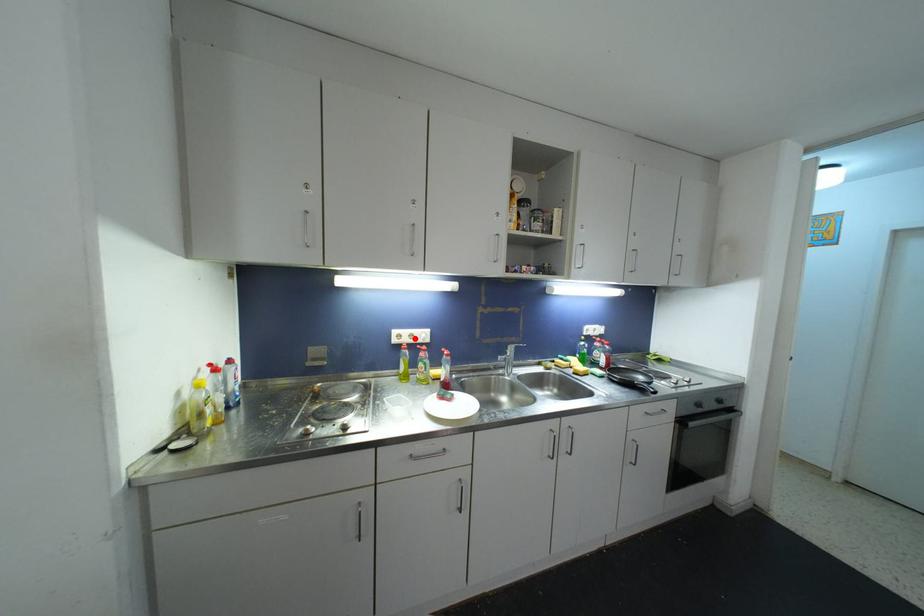
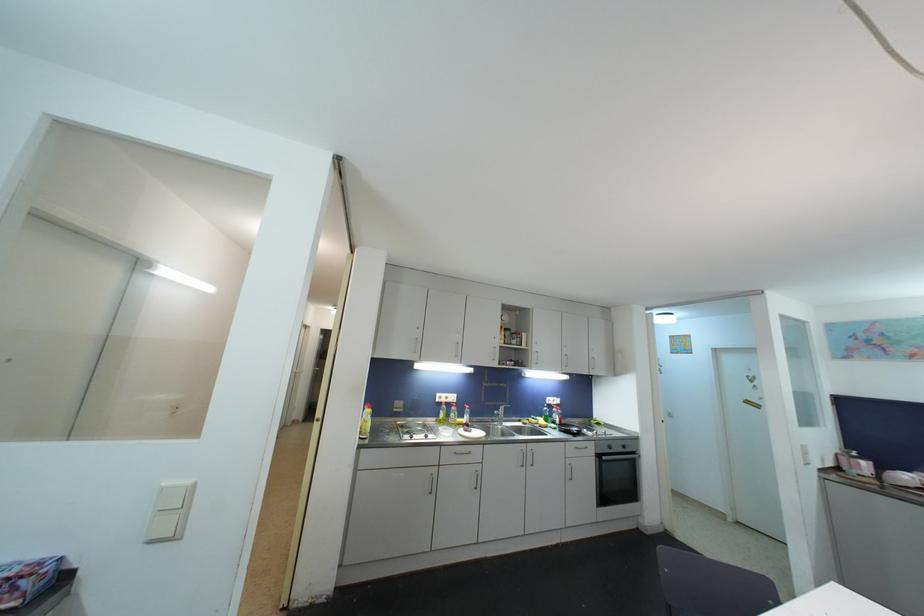
The point at the highlighted location is marked in the first image. Where is the corresponding point in the second image?

(450, 400)